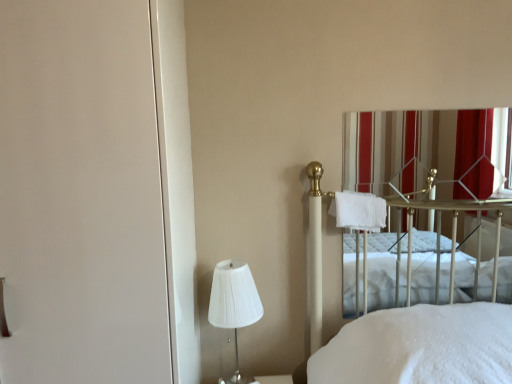
The image size is (512, 384). What do you see at coordinates (81, 195) in the screenshot?
I see `white matte screen door at left` at bounding box center [81, 195].

Describe the element at coordinates (234, 305) in the screenshot. I see `white pleated fabric lampshade at lower left` at that location.

Locate an element on the screen. This screenshot has width=512, height=384. white soft towel at center-right is located at coordinates (359, 211).

Which of these two, white matte screen door at left or striped fabric curtain at upper right, is smaller?

striped fabric curtain at upper right.

Does white matte screen door at left appear on the right side of striped fabric curtain at upper right?

No.

Is white matte screen door at left turned away from striped fabric curtain at upper right?

That's not correct — white matte screen door at left is not looking away from striped fabric curtain at upper right.

Is white soft towel at center-right to the right of white pleated fabric lampshade at lower left from the viewer's perspective?

Yes, white soft towel at center-right is to the right of white pleated fabric lampshade at lower left.

Considering the sizes of white soft towel at center-right and white pleated fabric lampshade at lower left in the image, is white soft towel at center-right taller or shorter than white pleated fabric lampshade at lower left?

Considering their sizes, white soft towel at center-right has less height than white pleated fabric lampshade at lower left.

Could you tell me if white soft towel at center-right is turned towards white pleated fabric lampshade at lower left?

No, white soft towel at center-right does not turn towards white pleated fabric lampshade at lower left.

From the image's perspective, is white soft towel at center-right below white pleated fabric lampshade at lower left?

Incorrect, from the image's perspective, white soft towel at center-right is higher than white pleated fabric lampshade at lower left.

Would you say white pleated fabric lampshade at lower left is to the left or to the right of striped fabric curtain at upper right in the picture?

Clearly, white pleated fabric lampshade at lower left is on the left of striped fabric curtain at upper right in the image.

Between point (233, 382) and point (469, 126), which one is positioned in front?

Positioned in front is point (233, 382).

Is white pleated fabric lampshade at lower left bigger than striped fabric curtain at upper right?

Yes.

Considering the relative sizes of white pleated fabric lampshade at lower left and striped fabric curtain at upper right in the image provided, is white pleated fabric lampshade at lower left thinner than striped fabric curtain at upper right?

Incorrect, the width of white pleated fabric lampshade at lower left is not less than that of striped fabric curtain at upper right.

Based on the photo, is white soft towel at center-right positioned far away from white matte screen door at left?

Yes, white soft towel at center-right is far from white matte screen door at left.

This screenshot has height=384, width=512. In order to click on screen door below the white soft towel at center-right (from the image's perspective) in this screenshot , I will do `click(81, 195)`.

Considering the sizes of white soft towel at center-right and white matte screen door at left in the image, is white soft towel at center-right wider or thinner than white matte screen door at left?

Considering their sizes, white soft towel at center-right looks slimmer than white matte screen door at left.

How far apart are white soft towel at center-right and white matte screen door at left?

1.02 meters.

Does white matte screen door at left have a lesser width compared to white soft towel at center-right?

No, white matte screen door at left is not thinner than white soft towel at center-right.

From a real-world perspective, is white matte screen door at left physically located above or below white soft towel at center-right?

white matte screen door at left is above white soft towel at center-right.

The width and height of the screenshot is (512, 384). Identify the location of cloth located on the right of white matte screen door at left. (359, 211).

Is white matte screen door at left oriented towards white soft towel at center-right?

No.

Can you confirm if striped fabric curtain at upper right is bigger than white pleated fabric lampshade at lower left?

Incorrect, striped fabric curtain at upper right is not larger than white pleated fabric lampshade at lower left.

Is striped fabric curtain at upper right located outside white pleated fabric lampshade at lower left?

Indeed, striped fabric curtain at upper right is completely outside white pleated fabric lampshade at lower left.

Which object is closer to the camera, striped fabric curtain at upper right or white pleated fabric lampshade at lower left?

white pleated fabric lampshade at lower left is closer to the camera.

From the image's perspective, is white pleated fabric lampshade at lower left over white matte screen door at left?

No, from the image's perspective, white pleated fabric lampshade at lower left is not on top of white matte screen door at left.

Between white pleated fabric lampshade at lower left and white matte screen door at left, which one appears on the right side from the viewer's perspective?

From the viewer's perspective, white pleated fabric lampshade at lower left appears more on the right side.

Is white pleated fabric lampshade at lower left further to the viewer compared to white matte screen door at left?

Yes, it is.

Does point (211, 317) come farther from viewer compared to point (69, 287)?

Yes, point (211, 317) is behind point (69, 287).

The width and height of the screenshot is (512, 384). In order to click on curtain on the right of white matte screen door at left in this screenshot , I will do `click(418, 150)`.

Find the location of a particular element. This screenshot has width=512, height=384. cloth behind the white pleated fabric lampshade at lower left is located at coordinates (359, 211).

Based on the photo, when comparing their distances from striped fabric curtain at upper right, does white pleated fabric lampshade at lower left or white matte screen door at left seem closer?

white pleated fabric lampshade at lower left is closer to striped fabric curtain at upper right.

When comparing their distances from white soft towel at center-right, does white matte screen door at left or white pleated fabric lampshade at lower left seem further?

Among the two, white matte screen door at left is located further to white soft towel at center-right.

Considering their positions, is white pleated fabric lampshade at lower left positioned further to striped fabric curtain at upper right than white soft towel at center-right?

Among the two, white pleated fabric lampshade at lower left is located further to striped fabric curtain at upper right.

Considering their positions, is white matte screen door at left positioned closer to striped fabric curtain at upper right than white soft towel at center-right?

white soft towel at center-right is closer to striped fabric curtain at upper right.

Looking at this image, based on their spatial positions, is striped fabric curtain at upper right or white matte screen door at left further from white pleated fabric lampshade at lower left?

striped fabric curtain at upper right is positioned further to the anchor white pleated fabric lampshade at lower left.

Considering their positions, is white soft towel at center-right positioned further to striped fabric curtain at upper right than white matte screen door at left?

white matte screen door at left is further to striped fabric curtain at upper right.

Looking at the image, which one is located further to white matte screen door at left, white pleated fabric lampshade at lower left or white soft towel at center-right?

Based on the image, white soft towel at center-right appears to be further to white matte screen door at left.

When comparing their distances from white pleated fabric lampshade at lower left, does white matte screen door at left or striped fabric curtain at upper right seem closer?

white matte screen door at left is closer to white pleated fabric lampshade at lower left.

Where is `cloth between white pleated fabric lampshade at lower left and striped fabric curtain at upper right from left to right`? cloth between white pleated fabric lampshade at lower left and striped fabric curtain at upper right from left to right is located at coordinates click(359, 211).

Where is `bedside lamp between white matte screen door at left and striped fabric curtain at upper right from left to right`? Image resolution: width=512 pixels, height=384 pixels. bedside lamp between white matte screen door at left and striped fabric curtain at upper right from left to right is located at coordinates (234, 305).

At what (x,y) coordinates should I click in order to perform the action: click on cloth located between white matte screen door at left and striped fabric curtain at upper right in the left-right direction. Please return your answer as a coordinate pair (x, y). This screenshot has height=384, width=512. Looking at the image, I should click on (359, 211).

Identify the location of bedside lamp between white matte screen door at left and white soft towel at center-right. This screenshot has width=512, height=384. (234, 305).